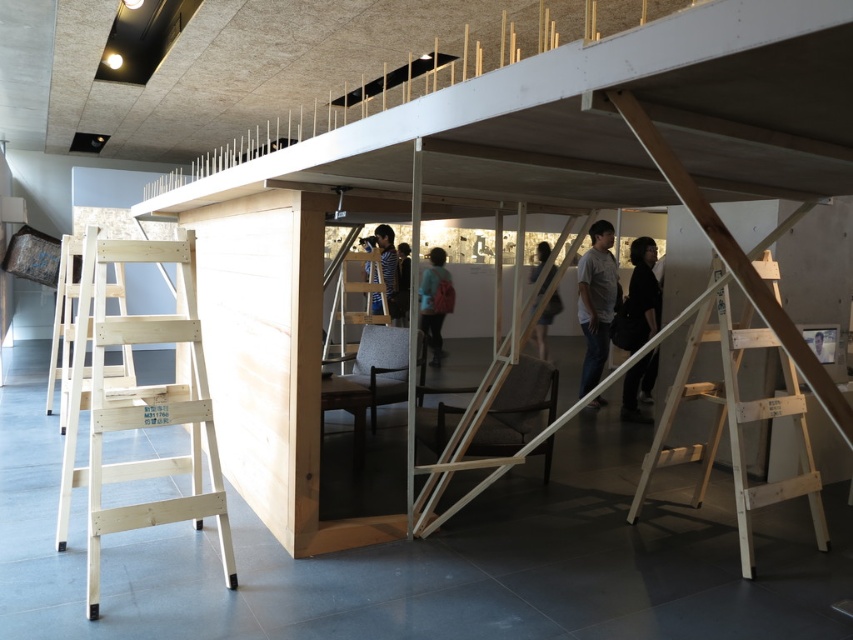
Does gray cotton shirt at center have a greater height compared to dark gray fabric chair at center?

Indeed, gray cotton shirt at center has a greater height compared to dark gray fabric chair at center.

Is gray cotton shirt at center thinner than dark gray fabric chair at center?

Correct, gray cotton shirt at center's width is less than dark gray fabric chair at center's.

The image size is (853, 640). I want to click on gray cotton shirt at center, so click(596, 300).

At what (x,y) coordinates should I click in order to perform the action: click on gray cotton shirt at center. Please return your answer as a coordinate pair (x, y). This screenshot has height=640, width=853. Looking at the image, I should click on (596, 300).

Is point (639, 285) positioned behind point (424, 291)?

No.

Who is positioned more to the right, black matte clothing at center or light blue fabric jacket at center?

black matte clothing at center

Identify the location of black matte clothing at center. (641, 296).

Is light brown wooden ladder at right to the right of light blue fabric jacket at center from the viewer's perspective?

Yes, light brown wooden ladder at right is to the right of light blue fabric jacket at center.

Is point (706, 298) positioned after point (421, 310)?

No, (706, 298) is in front of (421, 310).

This screenshot has height=640, width=853. What are the coordinates of `light brown wooden ladder at right` in the screenshot? It's located at (734, 420).